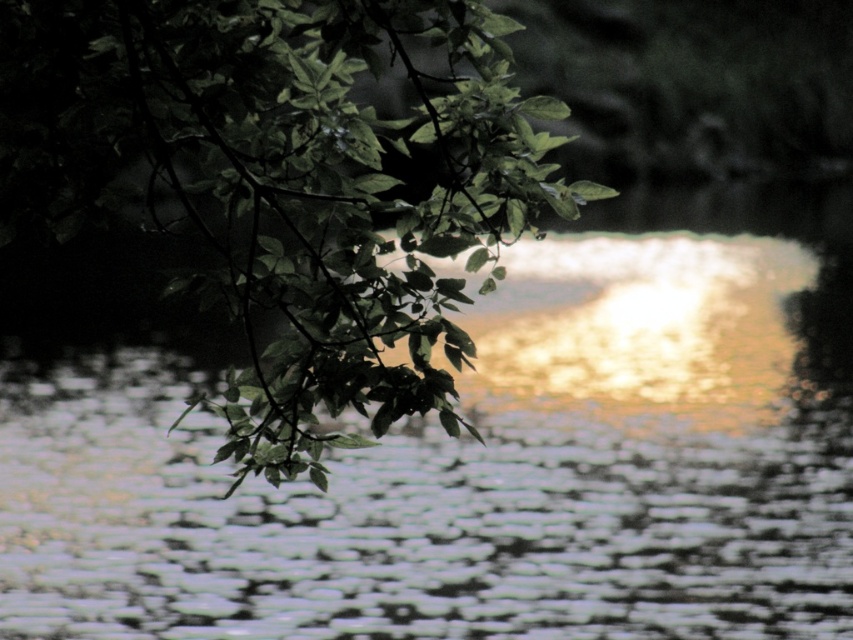
From the picture: Is glistening water at center wider than green leafy branch at upper left?

Correct, the width of glistening water at center exceeds that of green leafy branch at upper left.

Is point (675, 420) less distant than point (445, 131)?

No, (675, 420) is further to viewer.

Identify the location of glistening water at center. (488, 460).